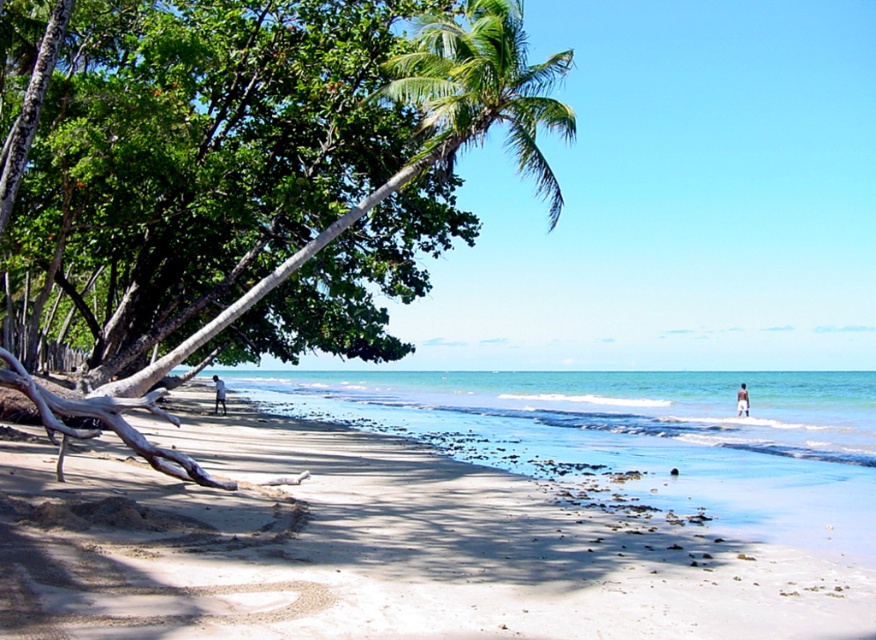
Question: Is the position of white sandy beach at center more distant than that of light brown skin at beach right?

Choices:
 (A) yes
 (B) no

Answer: (B)

Question: Which of these objects is positioned farthest from the white sandy beach at center?

Choices:
 (A) light brown skin at beach right
 (B) light brown skin at lower left

Answer: (A)

Question: Which object appears closest to the camera in this image?

Choices:
 (A) green leafy palm tree at upper center
 (B) white sandy beach at center
 (C) light brown skin at beach right
 (D) light brown skin at lower left

Answer: (B)

Question: Estimate the real-world distances between objects in this image. Which object is farther from the light brown skin at lower left?

Choices:
 (A) white sandy beach at center
 (B) green leafy palm tree at upper center
 (C) light brown skin at beach right

Answer: (C)

Question: Where is white sandy beach at center located in relation to light brown skin at lower left in the image?

Choices:
 (A) right
 (B) left

Answer: (A)

Question: Is green leafy palm tree at upper center to the left of light brown skin at lower left from the viewer's perspective?

Choices:
 (A) yes
 (B) no

Answer: (B)